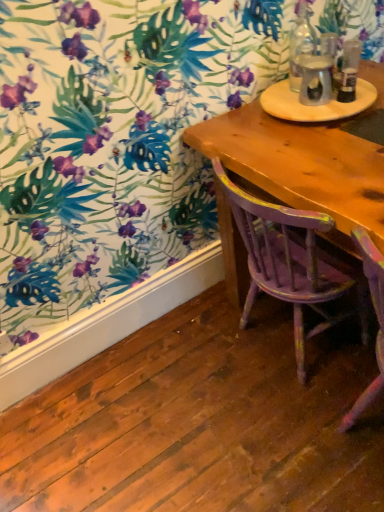
Where is `free space to the left of translucent glass bottle at upper right`? free space to the left of translucent glass bottle at upper right is located at coordinates (283, 109).